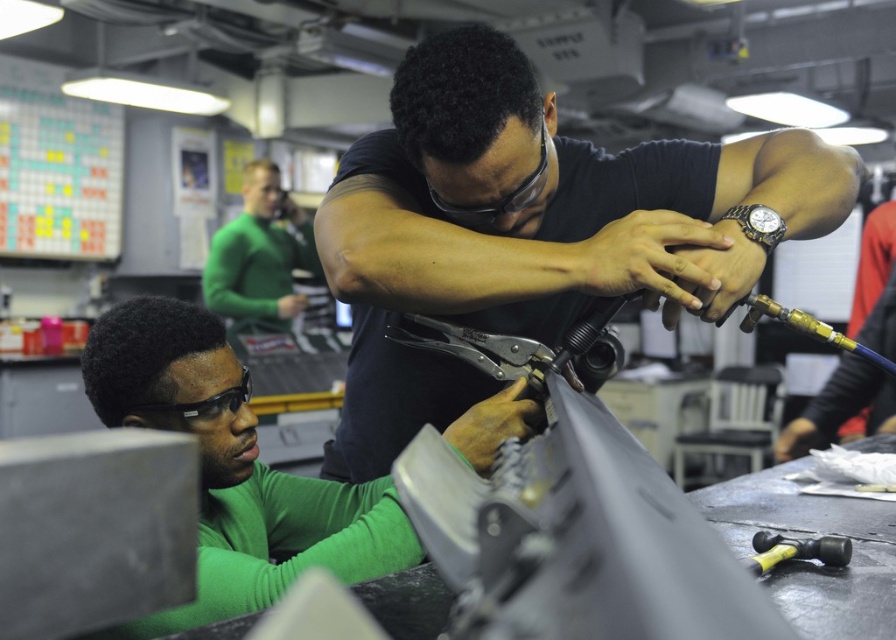
Is black matte tool at center bigger than metallic pliers at center?

Yes.

Can you confirm if black matte tool at center is positioned to the right of metallic pliers at center?

No, black matte tool at center is not to the right of metallic pliers at center.

Between point (754, 196) and point (602, 304), which one is positioned behind?

Positioned behind is point (602, 304).

Find the location of a particular element. The height and width of the screenshot is (640, 896). black matte tool at center is located at coordinates (533, 228).

Which is in front, point (372, 358) or point (333, 486)?

Point (372, 358)

Locate an element on the screen. The height and width of the screenshot is (640, 896). black matte tool at center is located at coordinates (533, 228).

Is point (777, 141) closer to camera compared to point (210, 328)?

Yes, point (777, 141) is closer to viewer.

Where is `black matte tool at center`? Image resolution: width=896 pixels, height=640 pixels. black matte tool at center is located at coordinates (533, 228).

Who is more distant from viewer, (345, 456) or (285, 234)?

Point (285, 234)

Is the position of black matte tool at center less distant than that of green matte shirt at upper center?

Yes, black matte tool at center is closer to the viewer.

Who is more forward, (817, 177) or (269, 257)?

Positioned in front is point (817, 177).

Identify the location of black matte tool at center. The width and height of the screenshot is (896, 640). (533, 228).